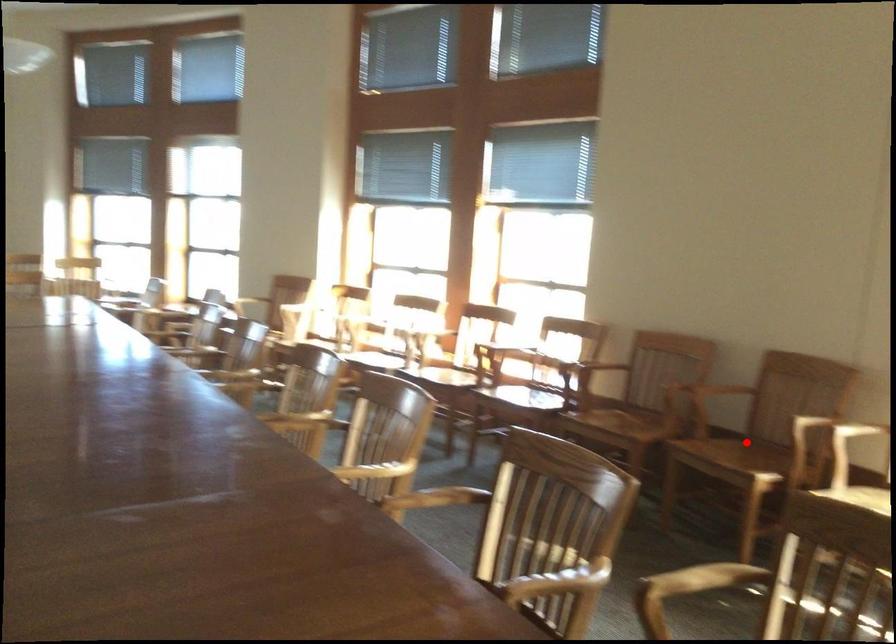
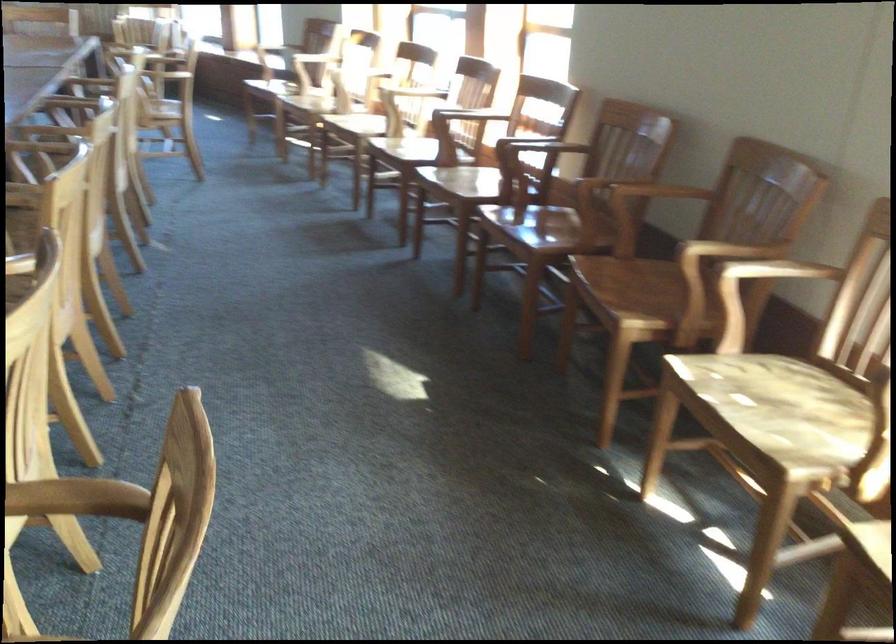
Question: I am providing you with two images of the same scene from different viewpoints. Image1 has a red point marked. In image2, the corresponding 3D location appears at what relative position? Reply with the corresponding letter.

Choices:
 (A) Closer
 (B) Farther

Answer: (A)